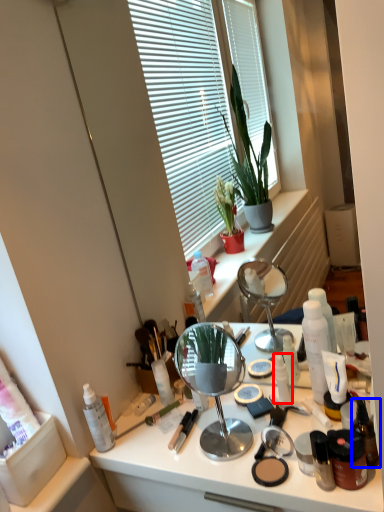
Question: Which of the following is the farthest to the observer, toiletry (highlighted by a red box) or toiletry (highlighted by a blue box)?

Choices:
 (A) toiletry
 (B) toiletry

Answer: (A)